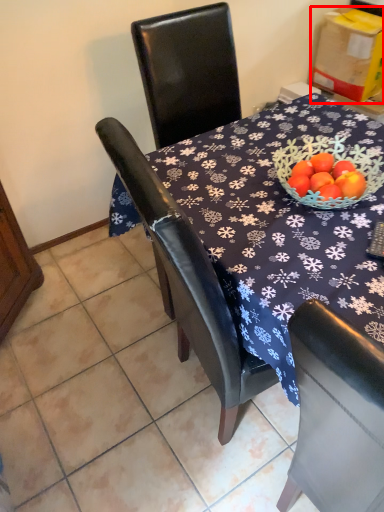
Question: From the image, what is the correct spatial relationship of cardboard box (annotated by the red box) in relation to tile?

Choices:
 (A) left
 (B) right

Answer: (B)